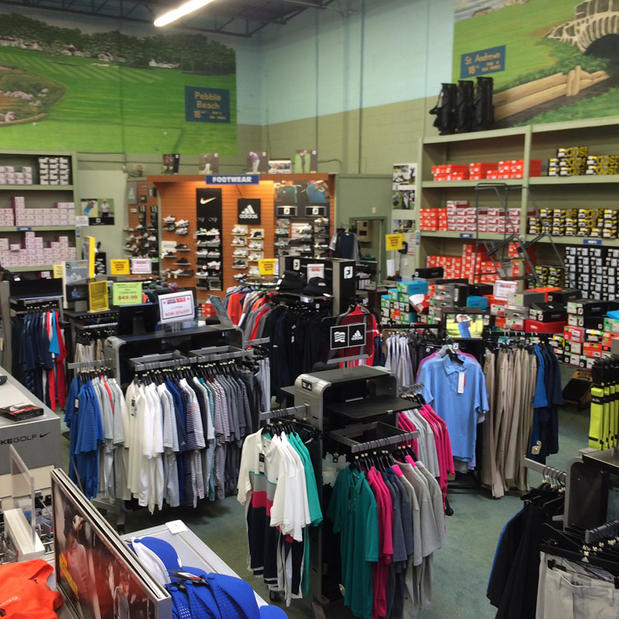
Image resolution: width=619 pixels, height=619 pixels. I want to click on racks, so click(x=390, y=434), click(x=293, y=413), click(x=219, y=347), click(x=459, y=345), click(x=524, y=332), click(x=387, y=319), click(x=93, y=322), click(x=48, y=295).